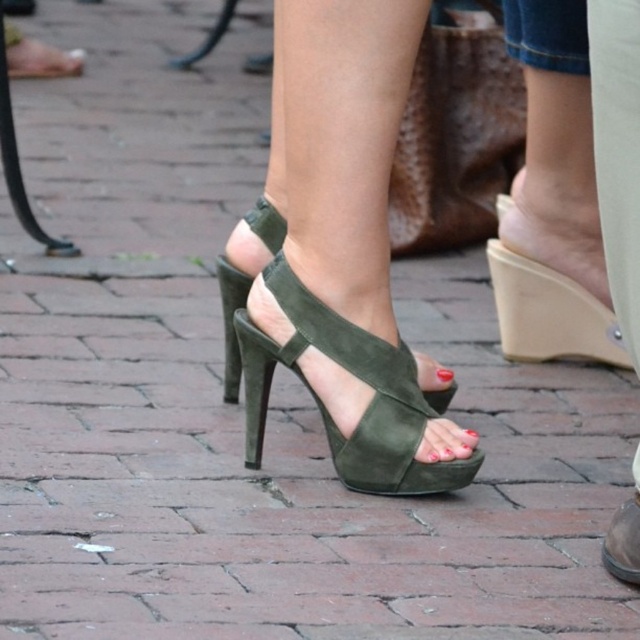
Question: Which of the following is the closest to the observer?

Choices:
 (A) suede olive green high-heeled sandal at center
 (B) green suede toe at center

Answer: (B)

Question: Does suede green sandal at center appear on the right side of suede olive green high-heeled sandal at center?

Choices:
 (A) no
 (B) yes

Answer: (B)

Question: Can you confirm if suede olive green high-heeled sandal at center is positioned below green suede toe at center?

Choices:
 (A) yes
 (B) no

Answer: (B)

Question: Estimate the real-world distances between objects in this image. Which object is closer to the red matte nail polish at center?

Choices:
 (A) suede olive green high-heeled sandal at center
 (B) green suede high-heeled sandal at center
 (C) leather high-heeled sandal at center
 (D) green suede toe at center

Answer: (D)

Question: Estimate the real-world distances between objects in this image. Which object is farther from the leather high-heeled sandal at center?

Choices:
 (A) suede green sandal at center
 (B) red matte nail polish at center
 (C) green suede high-heeled sandal at center

Answer: (C)

Question: Is suede olive green high-heeled sandal at center below leather high-heeled sandal at center?

Choices:
 (A) yes
 (B) no

Answer: (B)